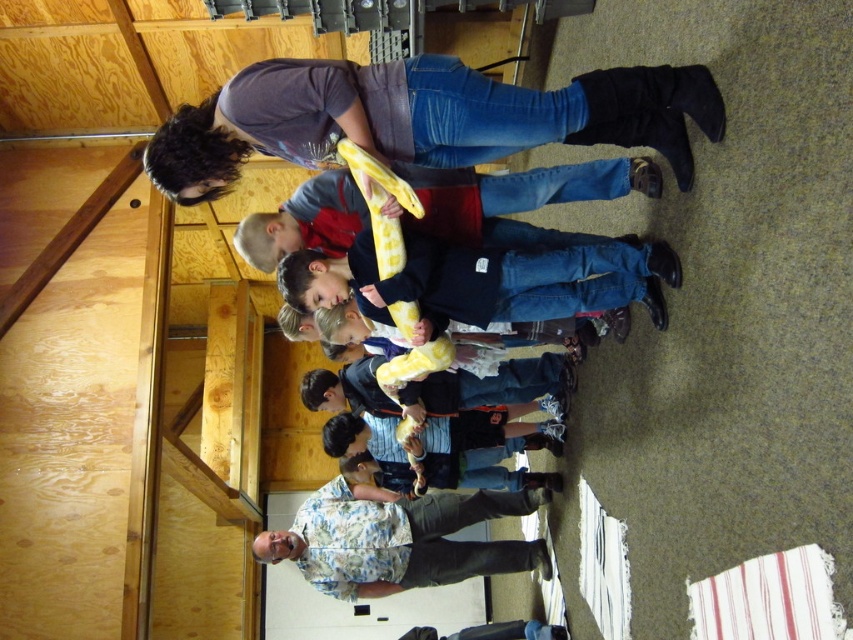
Question: Among these points, which one is nearest to the camera?

Choices:
 (A) (467, 320)
 (B) (605, 113)
 (C) (508, 515)
 (D) (540, 243)

Answer: (B)

Question: Which of the following is the farthest from the observer?

Choices:
 (A) (476, 253)
 (B) (323, 208)
 (C) (323, 496)

Answer: (C)

Question: Among these points, which one is nearest to the camera?

Choices:
 (A) (161, 147)
 (B) (425, 200)
 (C) (463, 548)
 (D) (468, 266)

Answer: (A)

Question: Is matte gray shirt at upper center to the left of floral shirt at lower center from the viewer's perspective?

Choices:
 (A) yes
 (B) no

Answer: (B)

Question: Is floral shirt at lower center above yellow patterned snake at center?

Choices:
 (A) yes
 (B) no

Answer: (B)

Question: Considering the relative positions of matte gray shirt at upper center and jeans at center in the image provided, where is matte gray shirt at upper center located with respect to jeans at center?

Choices:
 (A) above
 (B) below

Answer: (A)